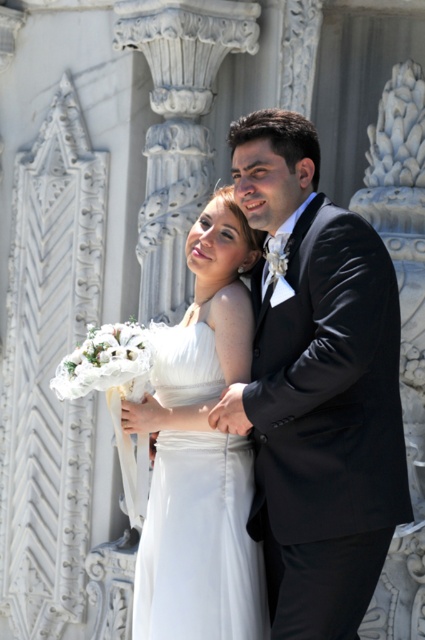
You are a photographer adjusting your camera to focus on two specific points in the wedding scene. The first point is at coordinate point (280, 344) and the second is at point (183, 536). Which point should you focus on first to ensure proper depth of field?

Point (280, 344) is closer to the viewer than point (183, 536), so you should focus on point (280, 344) first to ensure proper depth of field.

In the wedding scene, you notice the shiny black suit at center and the white satin dress at center. Which one appears to be smaller in size?

The shiny black suit at center has a smaller size compared to the white satin dress at center.